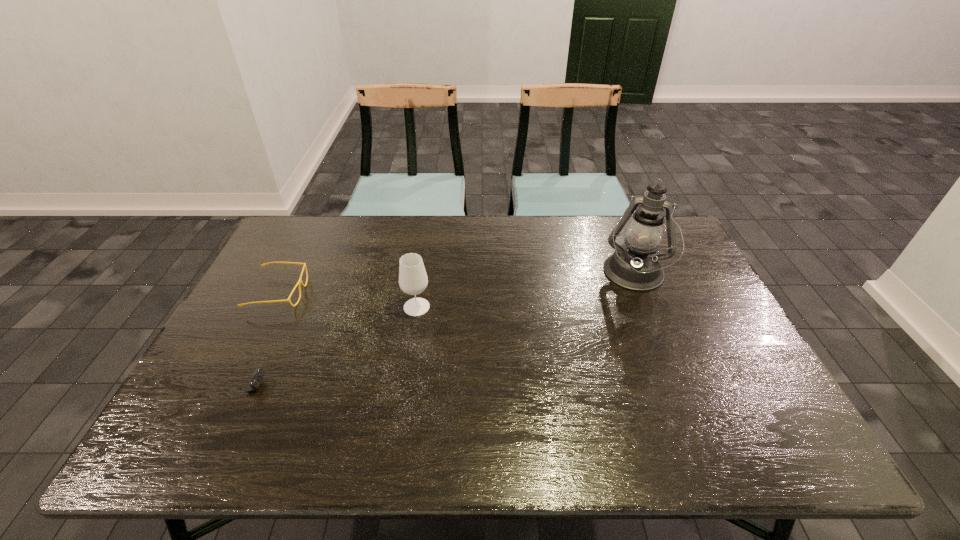
Point out which object is positioned as the second nearest to the third object from left to right. Please provide its 2D coordinates. Your answer should be formatted as a tuple, i.e. [(x, y)], where the tuple contains the x and y coordinates of a point satisfying the conditions above.

[(256, 379)]

The image size is (960, 540). Find the location of `object that is the second closest to the tallest object`. object that is the second closest to the tallest object is located at coordinates (299, 282).

The width and height of the screenshot is (960, 540). In order to click on free space that satisfies the following two spatial constraints: 1. on the front side of the second tallest object; 2. on the front-facing side of the shortest object in this screenshot , I will do `click(404, 387)`.

You are a GUI agent. You are given a task and a screenshot of the screen. Output one action in this format:
    pyautogui.click(x=<x>, y=<y>)
    Task: Click on the vacant space that satisfies the following two spatial constraints: 1. in front of the lenses of the third object from left to right; 2. on the right side of the spectacles
    Image resolution: width=960 pixels, height=540 pixels.
    Given the screenshot: What is the action you would take?
    click(x=272, y=307)

The width and height of the screenshot is (960, 540). I want to click on vacant region that satisfies the following two spatial constraints: 1. on the back side of the second object from right to left; 2. on the right side of the tallest object, so click(421, 275).

You are a GUI agent. You are given a task and a screenshot of the screen. Output one action in this format:
    pyautogui.click(x=<x>, y=<y>)
    Task: Click on the free location that satisfies the following two spatial constraints: 1. in front of the lenses of the second shortest object; 2. on the back side of the glass
    The image size is (960, 540).
    Given the screenshot: What is the action you would take?
    pyautogui.click(x=272, y=307)

This screenshot has height=540, width=960. Identify the location of vacant region that satisfies the following two spatial constraints: 1. on the front side of the tallest object; 2. on the front-facing side of the webcam. (678, 387).